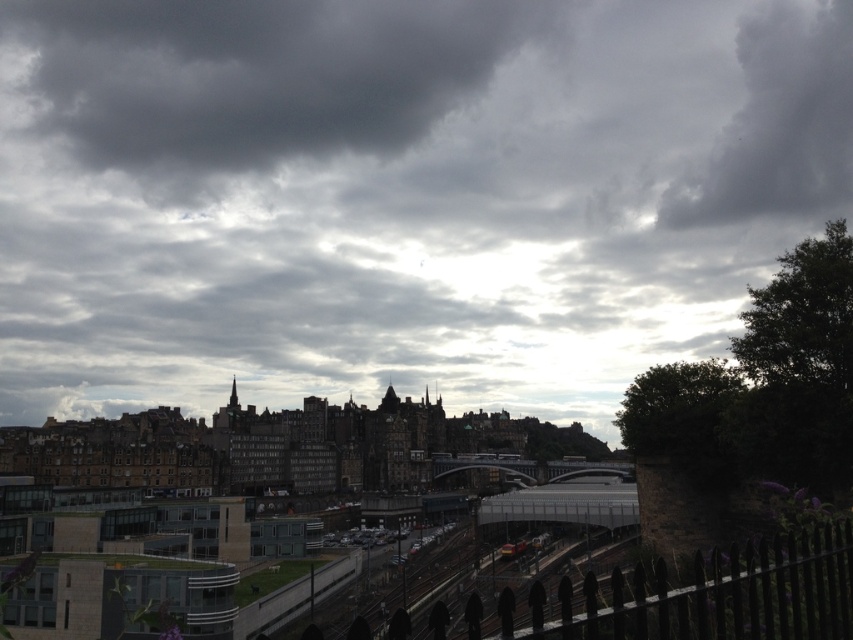
Between dark gray cloud at upper center and dark gray cloud at upper right, which one is positioned higher?

dark gray cloud at upper center is above.

Describe the element at coordinates (251, 77) in the screenshot. I see `dark gray cloud at upper center` at that location.

The height and width of the screenshot is (640, 853). Find the location of `dark gray cloud at upper center`. dark gray cloud at upper center is located at coordinates (251, 77).

Does dark gray cloud at upper center appear on the left side of black wrought iron fence at lower right?

Correct, you'll find dark gray cloud at upper center to the left of black wrought iron fence at lower right.

Is the position of dark gray cloud at upper center less distant than that of black wrought iron fence at lower right?

No, it is behind black wrought iron fence at lower right.

Is point (274, 22) less distant than point (688, 632)?

No, it is behind (688, 632).

This screenshot has height=640, width=853. I want to click on dark gray cloud at upper center, so pos(251,77).

How far apart are dark gray cloud at upper right and black wrought iron fence at lower right?

228.45 meters

In the scene shown: Is dark gray cloud at upper right bigger than black wrought iron fence at lower right?

No.

What do you see at coordinates (778, 122) in the screenshot? This screenshot has height=640, width=853. I see `dark gray cloud at upper right` at bounding box center [778, 122].

Locate an element on the screen. dark gray cloud at upper right is located at coordinates (778, 122).